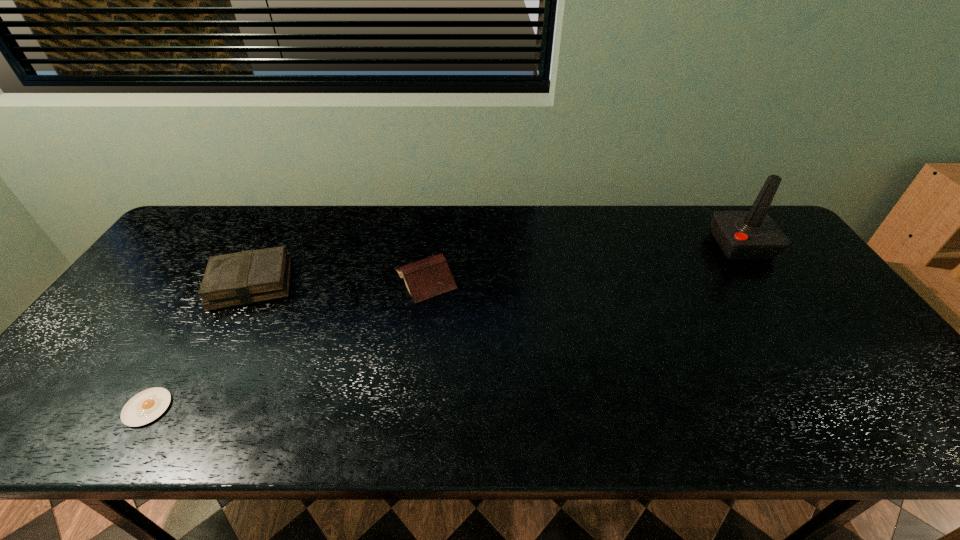
The height and width of the screenshot is (540, 960). Identify the location of object that is the second closest one to the left book. (431, 276).

This screenshot has width=960, height=540. I want to click on vacant point that satisfies the following two spatial constraints: 1. on the back side of the right book; 2. on the left side of the rightmost object, so click(x=429, y=245).

Image resolution: width=960 pixels, height=540 pixels. What are the coordinates of `free space that satisfies the following two spatial constraints: 1. on the back side of the right book; 2. on the left side of the rightmost object` in the screenshot? It's located at (429, 245).

In order to click on vacant position in the image that satisfies the following two spatial constraints: 1. on the back side of the joystick; 2. on the right side of the left book in this screenshot , I will do `click(272, 245)`.

The width and height of the screenshot is (960, 540). What are the coordinates of `vacant space that satisfies the following two spatial constraints: 1. on the back side of the third object from left to right; 2. on the left side of the rightmost object` in the screenshot? It's located at (429, 245).